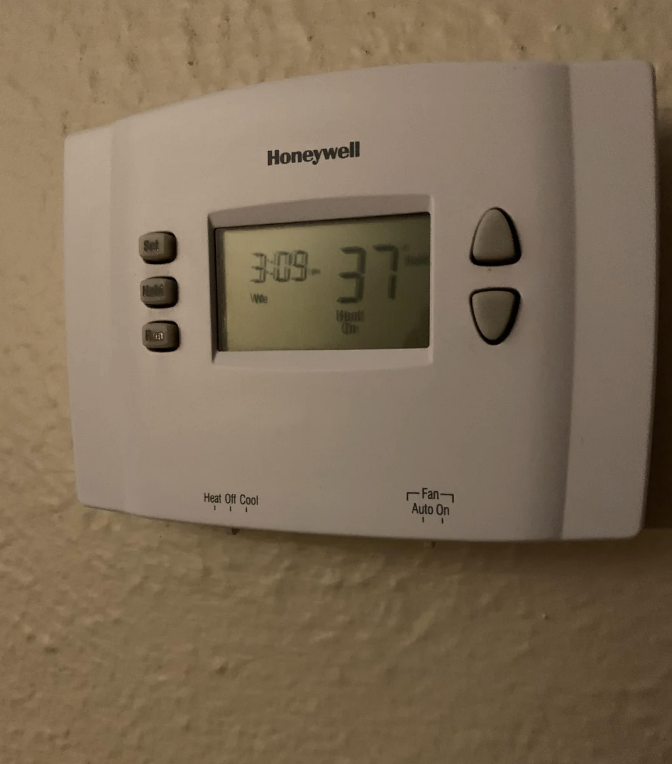
This screenshot has height=764, width=672. I want to click on push button, so click(x=164, y=290).